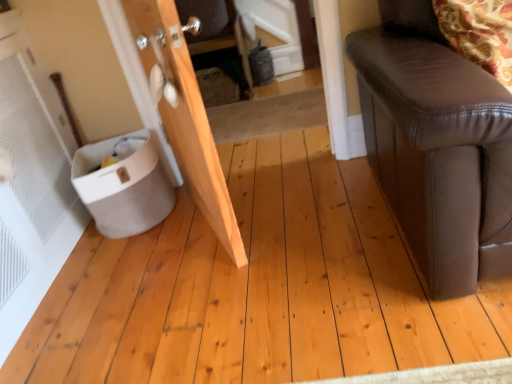
Question: Is point (189, 167) closer or farther from the camera than point (79, 152)?

Choices:
 (A) closer
 (B) farther

Answer: (A)

Question: Considering the positions of natural wood door at left and white fabric potty at lower left in the image, is natural wood door at left taller or shorter than white fabric potty at lower left?

Choices:
 (A) tall
 (B) short

Answer: (A)

Question: Considering the relative positions of natural wood door at left and white fabric potty at lower left in the image provided, is natural wood door at left to the left or to the right of white fabric potty at lower left?

Choices:
 (A) left
 (B) right

Answer: (B)

Question: From the image's perspective, relative to natural wood door at left, is white fabric potty at lower left above or below?

Choices:
 (A) below
 (B) above

Answer: (A)

Question: Based on their sizes in the image, would you say white fabric potty at lower left is bigger or smaller than natural wood door at left?

Choices:
 (A) big
 (B) small

Answer: (B)

Question: Is white fabric potty at lower left taller or shorter than natural wood door at left?

Choices:
 (A) short
 (B) tall

Answer: (A)

Question: Considering the positions of white fabric potty at lower left and natural wood door at left in the image, is white fabric potty at lower left wider or thinner than natural wood door at left?

Choices:
 (A) thin
 (B) wide

Answer: (B)